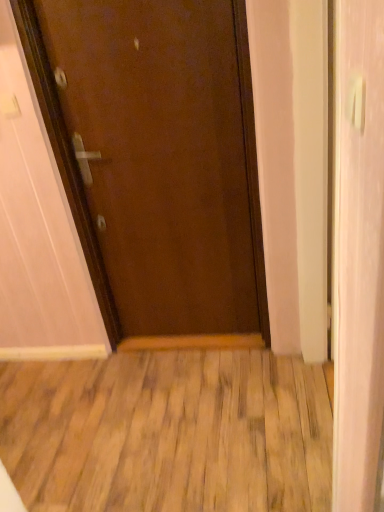
Describe the element at coordinates (359, 261) in the screenshot. I see `white glossy door at right` at that location.

Describe the element at coordinates (168, 433) in the screenshot. I see `wooden floor at center` at that location.

Locate an element on the screen. The width and height of the screenshot is (384, 512). wooden floor at center is located at coordinates (168, 433).

This screenshot has height=512, width=384. I want to click on brown matte door at center, so click(167, 157).

Is point (373, 76) closer to viewer compared to point (102, 470)?

Yes, it is.

This screenshot has width=384, height=512. In order to click on screen door positioned vertically above the wooden floor at center (from a real-world perspective) in this screenshot , I will do `click(359, 261)`.

From the image's perspective, is white glossy door at right positioned above or below wooden floor at center?

white glossy door at right is situated higher than wooden floor at center in the image.

Is brown matte door at center not within wooden floor at center?

Yes, brown matte door at center is not within wooden floor at center.

Who is shorter, brown matte door at center or wooden floor at center?

wooden floor at center is shorter.

Which of these two, brown matte door at center or wooden floor at center, is smaller?

Smaller between the two is wooden floor at center.

Find the location of a particular element. This screenshot has width=384, height=512. wood that appears below the brown matte door at center (from a real-world perspective) is located at coordinates (168, 433).

Which of these two, brown matte door at center or white glossy door at right, is wider?

brown matte door at center.

Which object is positioned more to the left, brown matte door at center or white glossy door at right?

Result: Positioned to the left is brown matte door at center.

In the scene shown: Does brown matte door at center turn towards white glossy door at right?

No, brown matte door at center is not facing towards white glossy door at right.

The image size is (384, 512). What are the coordinates of `door behind the white glossy door at right` in the screenshot? It's located at (167, 157).

Find the location of a particular element. This screenshot has width=384, height=512. screen door on the right of wooden floor at center is located at coordinates (359, 261).

Is wooden floor at center to the left of white glossy door at right from the viewer's perspective?

Indeed, wooden floor at center is positioned on the left side of white glossy door at right.

Is wooden floor at center shorter than white glossy door at right?

Indeed, wooden floor at center has a lesser height compared to white glossy door at right.

Would you say white glossy door at right is part of wooden floor at center's contents?

Actually, white glossy door at right is outside wooden floor at center.

Which object is further away from the camera taking this photo, white plastic door handle at upper right or brown matte door at center?

brown matte door at center is more distant.

Is point (355, 99) closer or farther from the camera than point (61, 54)?

Point (355, 99) is positioned closer to the camera compared to point (61, 54).

From a real-world perspective, who is located higher, white plastic door handle at upper right or brown matte door at center?

white plastic door handle at upper right, from a real-world perspective.

Between wooden floor at center and white plastic door handle at upper right, which one is positioned in front?

white plastic door handle at upper right.

Is wooden floor at center looking in the opposite direction of white plastic door handle at upper right?

No, wooden floor at center is not facing away from white plastic door handle at upper right.

Is wooden floor at center positioned far away from white plastic door handle at upper right?

Yes, wooden floor at center is far from white plastic door handle at upper right.

Which point is more forward, (71,483) or (356,88)?

The point (356,88) is closer to the camera.

Between wooden floor at center and brown matte door at center, which one is positioned behind?

Positioned behind is brown matte door at center.

Is wooden floor at center beside brown matte door at center?

No, wooden floor at center is not making contact with brown matte door at center.

Which of these two, wooden floor at center or brown matte door at center, is wider?

wooden floor at center.

From the image's perspective, which object appears higher, wooden floor at center or brown matte door at center?

brown matte door at center.

At what (x,y) coordinates should I click in order to perform the action: click on wood that is behind the white glossy door at right. Please return your answer as a coordinate pair (x, y). Looking at the image, I should click on (168, 433).

At what (x,y) coordinates should I click in order to perform the action: click on wood below the brown matte door at center (from a real-world perspective). Please return your answer as a coordinate pair (x, y). Looking at the image, I should click on click(168, 433).

Based on the photo, which object lies nearer to the anchor point white glossy door at right, white plastic door handle at upper right or wooden floor at center?

The object closer to white glossy door at right is white plastic door handle at upper right.

Considering their positions, is white plastic door handle at upper right positioned closer to wooden floor at center than white glossy door at right?

white glossy door at right lies closer to wooden floor at center than the other object.

Looking at the image, which one is located further to white glossy door at right, brown matte door at center or wooden floor at center?

brown matte door at center lies further to white glossy door at right than the other object.

From the image, which object appears to be farther from brown matte door at center, white glossy door at right or wooden floor at center?

Among the two, white glossy door at right is located further to brown matte door at center.

When comparing their distances from wooden floor at center, does white glossy door at right or white plastic door handle at upper right seem further?

white plastic door handle at upper right lies further to wooden floor at center than the other object.

Looking at the image, which one is located closer to wooden floor at center, white plastic door handle at upper right or brown matte door at center?

Based on the image, brown matte door at center appears to be nearer to wooden floor at center.

From the image, which object appears to be farther from white plastic door handle at upper right, brown matte door at center or wooden floor at center?

Based on the image, wooden floor at center appears to be further to white plastic door handle at upper right.

Estimate the real-world distances between objects in this image. Which object is closer to brown matte door at center, wooden floor at center or white glossy door at right?

Based on the image, wooden floor at center appears to be nearer to brown matte door at center.

Identify the location of door handle between brown matte door at center and wooden floor at center vertically. The height and width of the screenshot is (512, 384). (356, 103).

You are a GUI agent. You are given a task and a screenshot of the screen. Output one action in this format:
    pyautogui.click(x=<x>, y=<y>)
    Task: Click on the screen door that lies between brown matte door at center and wooden floor at center from top to bottom
    
    Given the screenshot: What is the action you would take?
    pyautogui.click(x=359, y=261)

Image resolution: width=384 pixels, height=512 pixels. Identify the location of screen door between white plastic door handle at upper right and wooden floor at center from top to bottom. (359, 261).

At what (x,y) coordinates should I click in order to perform the action: click on screen door between white plastic door handle at upper right and brown matte door at center along the z-axis. Please return your answer as a coordinate pair (x, y). The image size is (384, 512). Looking at the image, I should click on (359, 261).